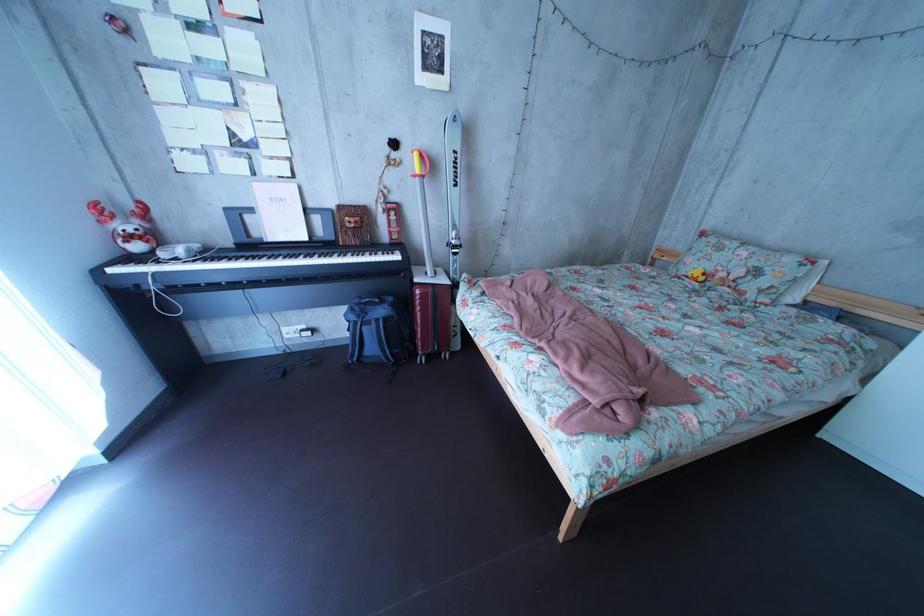
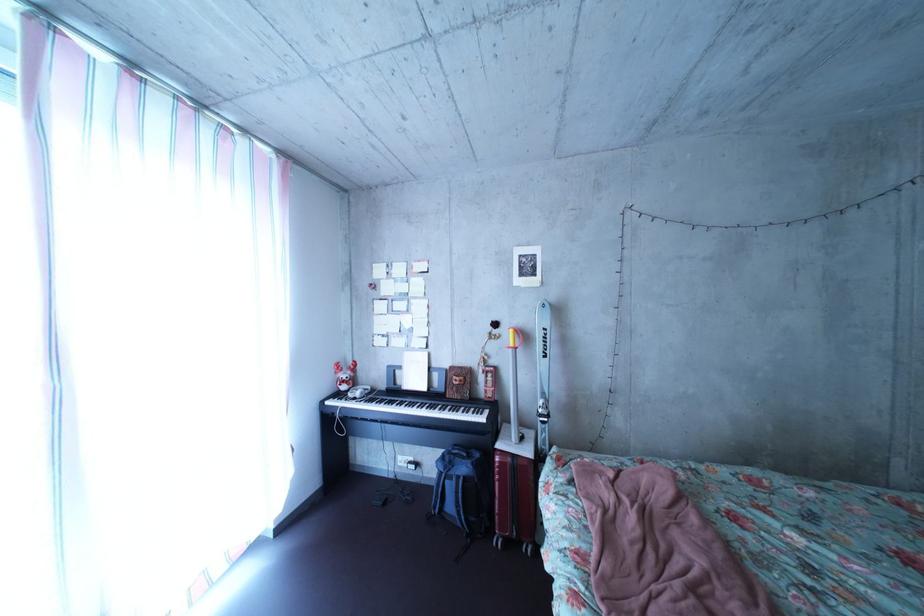
In the second image, find the point that corresponds to [408,163] in the first image.

(509, 339)